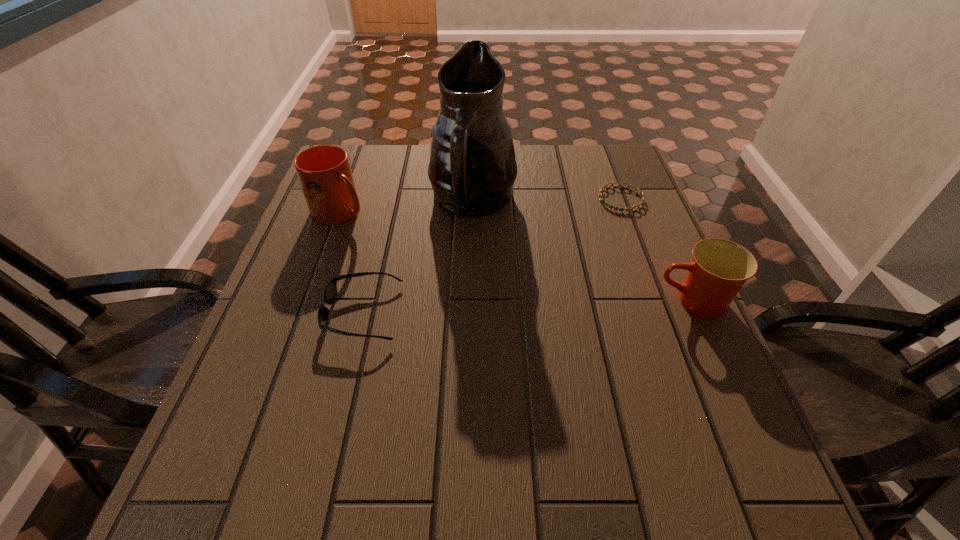
The height and width of the screenshot is (540, 960). I want to click on sunglasses, so click(330, 293).

Where is `the third shortest object`? the third shortest object is located at coordinates (719, 268).

Where is `the second tallest object`? the second tallest object is located at coordinates (324, 172).

You are a GUI agent. You are given a task and a screenshot of the screen. Output one action in this format:
    pyautogui.click(x=<x>, y=<y>)
    Task: Click on the third object from right to left
    The height and width of the screenshot is (540, 960).
    Given the screenshot: What is the action you would take?
    tap(472, 169)

At what (x,y) coordinates should I click in order to perform the action: click on the tallest object. Please return your answer as a coordinate pair (x, y). Looking at the image, I should click on (472, 169).

This screenshot has height=540, width=960. I want to click on bracelet, so click(x=603, y=201).

Locate an element on the screen. This screenshot has height=540, width=960. vacant space situated 0.130m on the back of the cup is located at coordinates (666, 244).

In order to click on vacant space positioned 0.230m on the handle side of the mug in this screenshot , I will do `click(424, 260)`.

You are a GUI agent. You are given a task and a screenshot of the screen. Output one action in this format:
    pyautogui.click(x=<x>, y=<y>)
    Task: Click on the vacant region located on the handle side of the mug
    The width and height of the screenshot is (960, 540).
    Given the screenshot: What is the action you would take?
    404,248

At what (x,y) coordinates should I click in order to perform the action: click on vacant area situated 0.250m on the handle side of the mug. Please return your answer as a coordinate pair (x, y). This screenshot has height=540, width=960. Looking at the image, I should click on (431, 264).